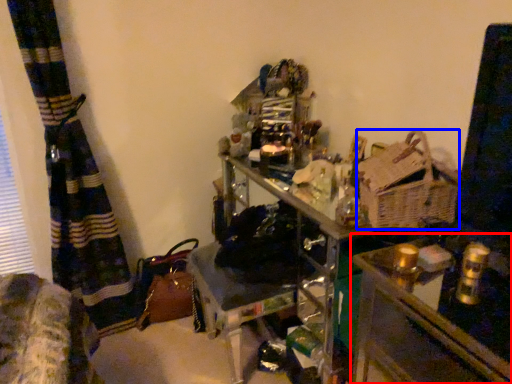
Question: Which of the following is the closest to the observer, table (highlighted by a red box) or basket (highlighted by a blue box)?

Choices:
 (A) table
 (B) basket

Answer: (A)